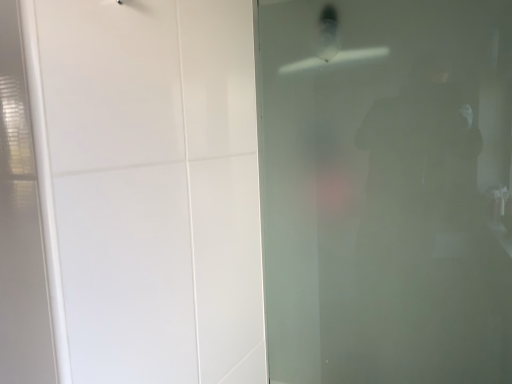
Describe the element at coordinates (387, 191) in the screenshot. This screenshot has height=384, width=512. I see `frosted glass door at right` at that location.

The image size is (512, 384). What are the coordinates of `frosted glass door at right` in the screenshot? It's located at (387, 191).

The height and width of the screenshot is (384, 512). Find the location of `frosted glass door at right`. frosted glass door at right is located at coordinates (387, 191).